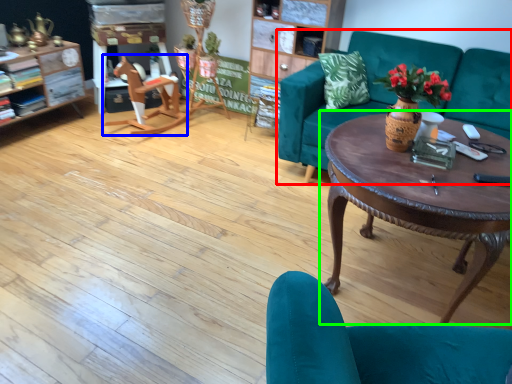
Question: Which is farther away from studio couch (highlighted by a red box)? wide (highlighted by a blue box) or coffee table (highlighted by a green box)?

Choices:
 (A) wide
 (B) coffee table

Answer: (A)